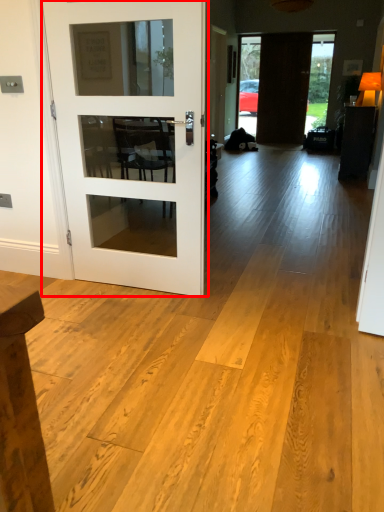
Question: From the image's perspective, what is the correct spatial positioning of door (annotated by the red box) in reference to door?

Choices:
 (A) below
 (B) above

Answer: (A)